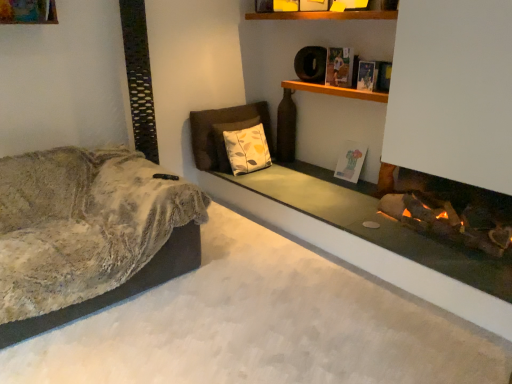
This screenshot has height=384, width=512. I want to click on unoccupied region to the right of fuzzy beige couch at left, so click(x=250, y=283).